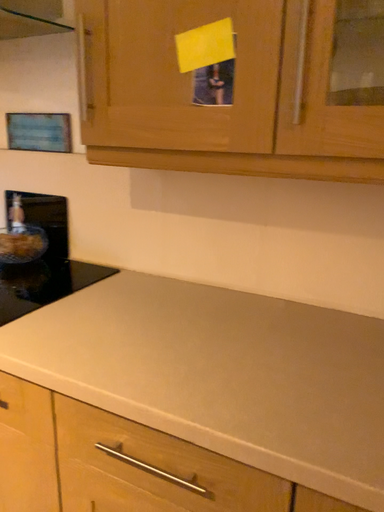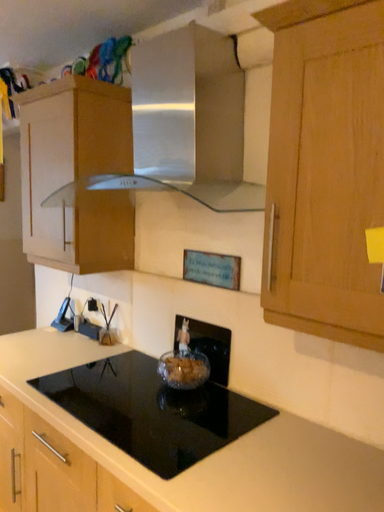
Question: Which way did the camera rotate in the video?

Choices:
 (A) rotated upward
 (B) rotated downward

Answer: (A)